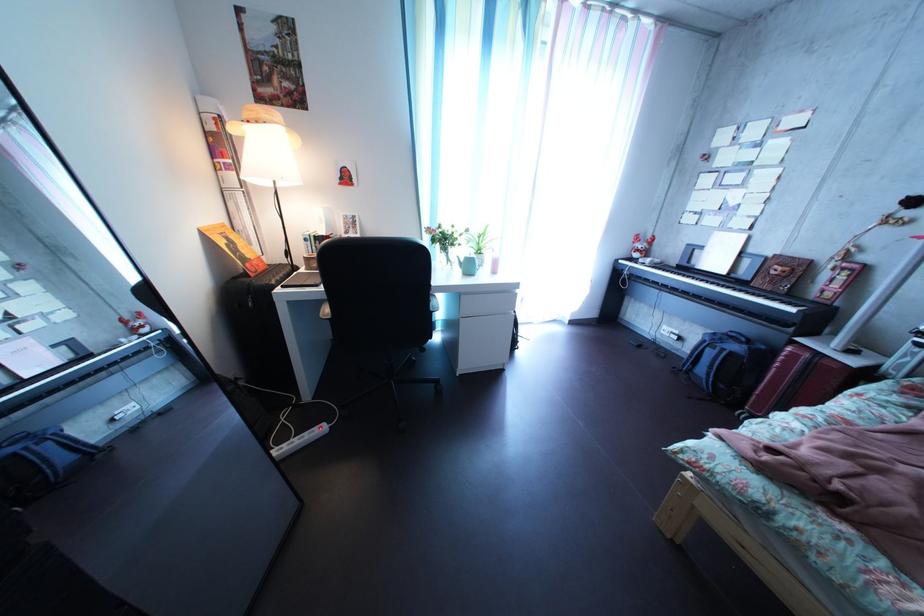
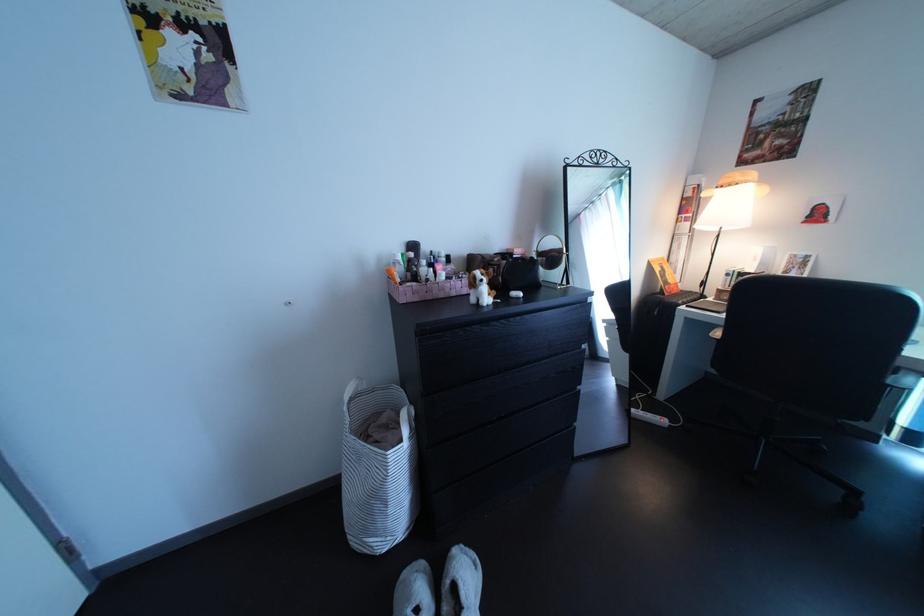
Question: The camera is either moving clockwise (left) or counter-clockwise (right) around the object. The first image is from the beginning of the video and the second image is from the end. Is the camera moving left or right when shooting the video?

Choices:
 (A) Left
 (B) Right

Answer: (B)